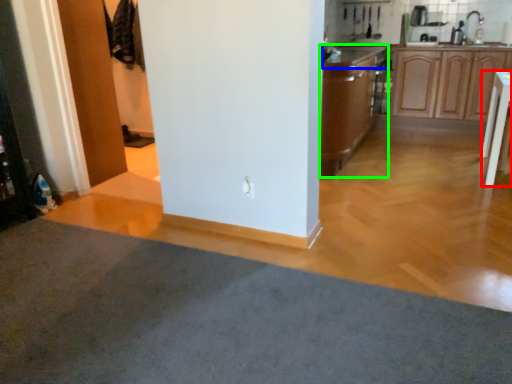
Question: Considering the real-world distances, which object is farthest from table (highlighted by a red box)? countertop (highlighted by a blue box) or cabinetry (highlighted by a green box)?

Choices:
 (A) countertop
 (B) cabinetry

Answer: (A)